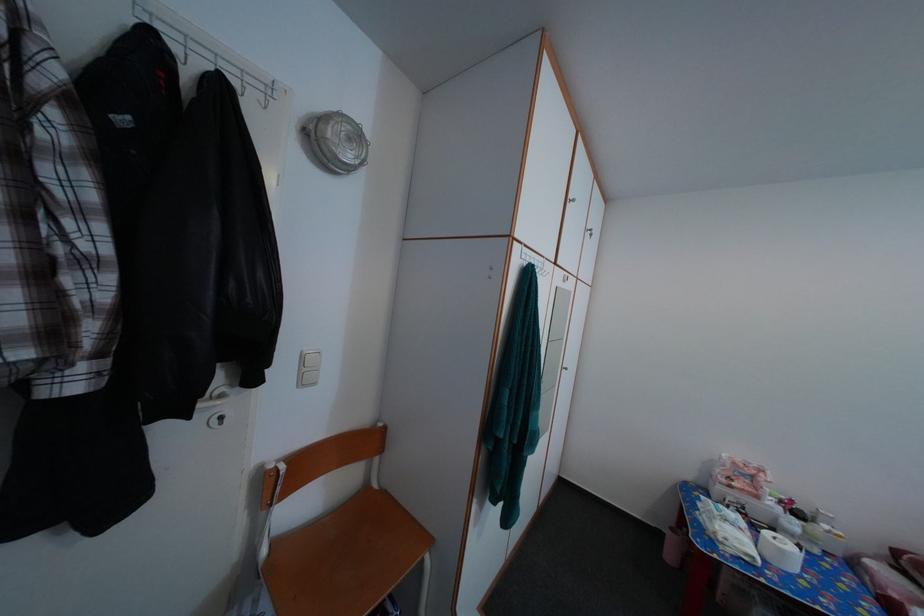
You are a GUI agent. You are given a task and a screenshot of the screen. Output one action in this format:
    pyautogui.click(x=<x>, y=<y>)
    Task: Click on the chair sitting surface
    The height and width of the screenshot is (616, 924).
    Given the screenshot: What is the action you would take?
    pyautogui.click(x=345, y=557)